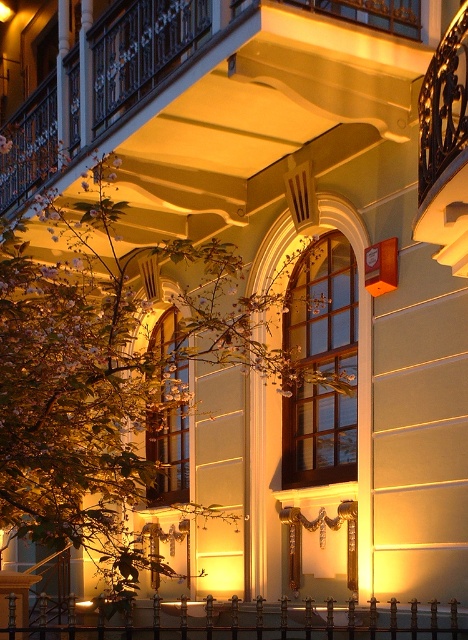
You are standing in front of the building facade and want to locate the matte glass window at center. Can you tell me its exact coordinates?

The matte glass window at center is located at coordinates point (323, 307).

You are standing in front of the building and want to touch the matte glass window at center and the black wrought iron railing at lower center. Which object will you reach first?

You will reach the matte glass window at center first because it is closer to you than the black wrought iron railing at lower center.